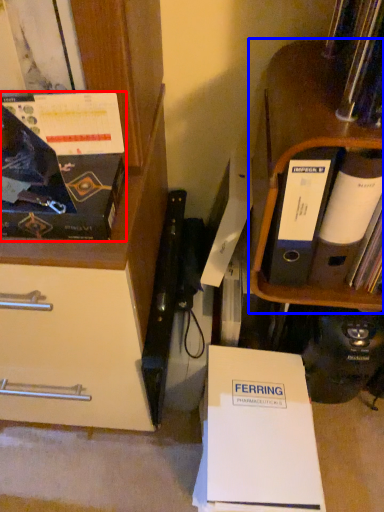
Question: Which point is closer to the camera, magazine (highlighted by a red box) or shelf (highlighted by a blue box)?

Choices:
 (A) magazine
 (B) shelf

Answer: (A)